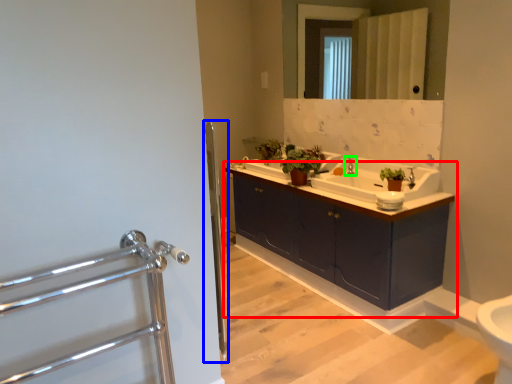
Question: Considering the real-world distances, which object is farthest from bathroom cabinet (highlighted by a red box)? screen door (highlighted by a blue box) or tap (highlighted by a green box)?

Choices:
 (A) screen door
 (B) tap

Answer: (A)